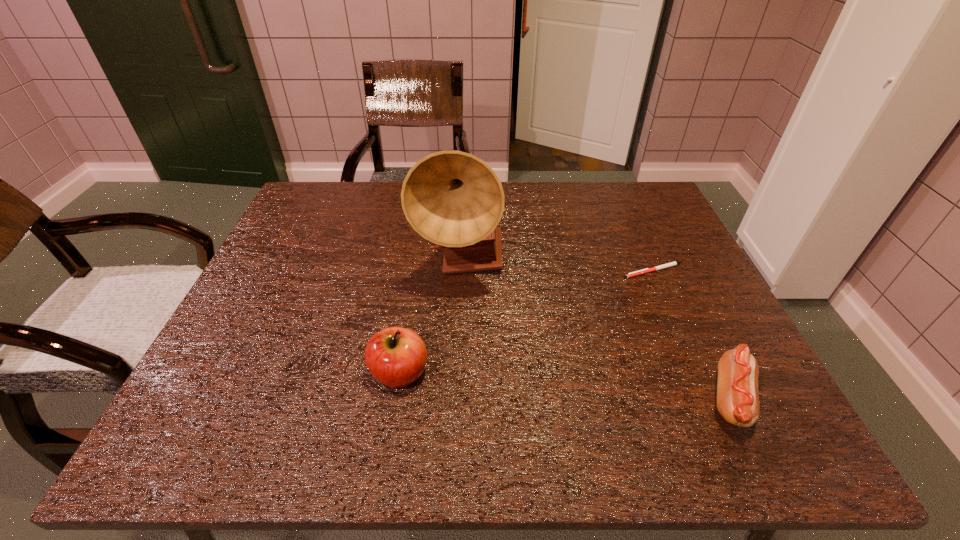
Locate an element on the screen. The image size is (960, 540). apple is located at coordinates (396, 357).

The width and height of the screenshot is (960, 540). Find the location of `the second shortest object`. the second shortest object is located at coordinates (737, 387).

Where is `the shortest object`? Image resolution: width=960 pixels, height=540 pixels. the shortest object is located at coordinates click(643, 271).

Find the location of `phonograph record`. phonograph record is located at coordinates (454, 199).

You are a GUI agent. You are given a task and a screenshot of the screen. Output one action in this format:
    pyautogui.click(x=<x>, y=<y>)
    Task: Click on the vacant space located 0.200m on the back of the apple
    Image resolution: width=960 pixels, height=540 pixels.
    Given the screenshot: What is the action you would take?
    pyautogui.click(x=414, y=286)

Find the location of a particular element. vacant area situated 0.220m on the left of the second shortest object is located at coordinates (589, 399).

Locate an element on the screen. This screenshot has height=540, width=960. free location located 0.050m on the clicker of the pen is located at coordinates pyautogui.click(x=627, y=288).

Identify the location of vacant space located on the clicker of the pen. (627, 288).

Locate an element on the screen. This screenshot has width=960, height=540. free space located 0.280m on the clicker of the pen is located at coordinates (581, 346).

Image resolution: width=960 pixels, height=540 pixels. Find the location of `vacant point located 0.060m on the horn of the phonograph record`. vacant point located 0.060m on the horn of the phonograph record is located at coordinates (492, 311).